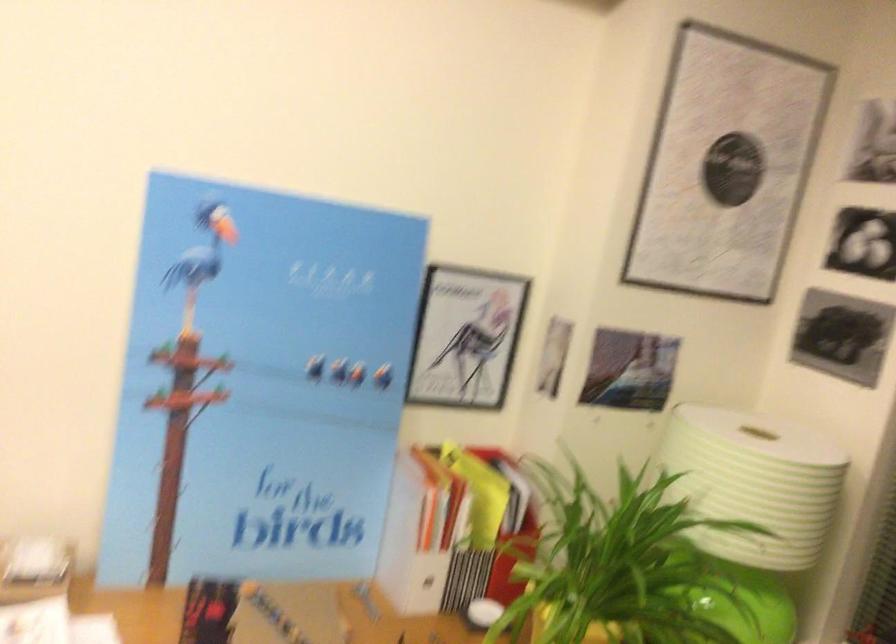
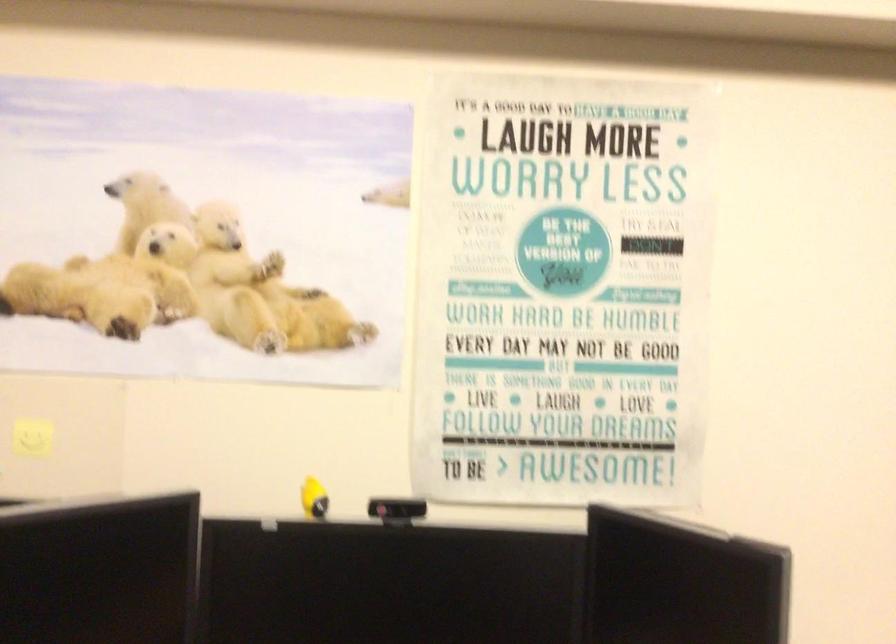
Question: The camera is either moving clockwise (left) or counter-clockwise (right) around the object. The first image is from the beginning of the video and the second image is from the end. Is the camera moving left or right when shooting the video?

Choices:
 (A) Left
 (B) Right

Answer: (B)